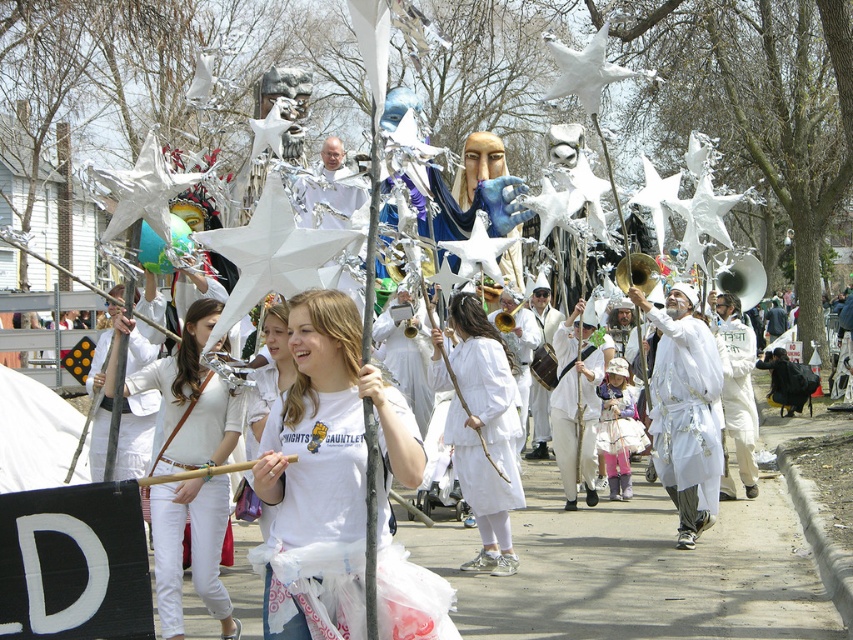
Based on the photo, you are a photographer at the parade and want to capture both the white cotton shirt at center and the white matte dress at center in a single frame. Which one should you focus on first to ensure both are in the shot?

The white cotton shirt at center is to the left of white matte dress at center, so focusing on the white cotton shirt at center first will ensure both are captured in the frame since it is positioned to the left of the dress.

You are a photographer standing at the edge of the parade route. You want to take a photo that includes both the white cotton shirt at center and the white matte mask at center. Given that your camera has a maximum focus range of 6 meters, will you be able to capture both objects in focus without moving closer?

The distance between the white cotton shirt at center and the white matte mask at center is 6.05 meters. Since the camera can only focus up to 6 meters, the objects are slightly out of the focus range. You might need to adjust your position or use a different setting to ensure both are in focus.

You are a photographer trying to capture the perfect shot of the parade. You notice the white cotton shirt at center and the white matte mask at center. Which object should you focus on first if you want to ensure both are in focus without adjusting your camera settings?

The white cotton shirt at center is closer to the viewer than the white matte mask at center, so focusing on the closer object first will help ensure both are in focus using the depth of field.